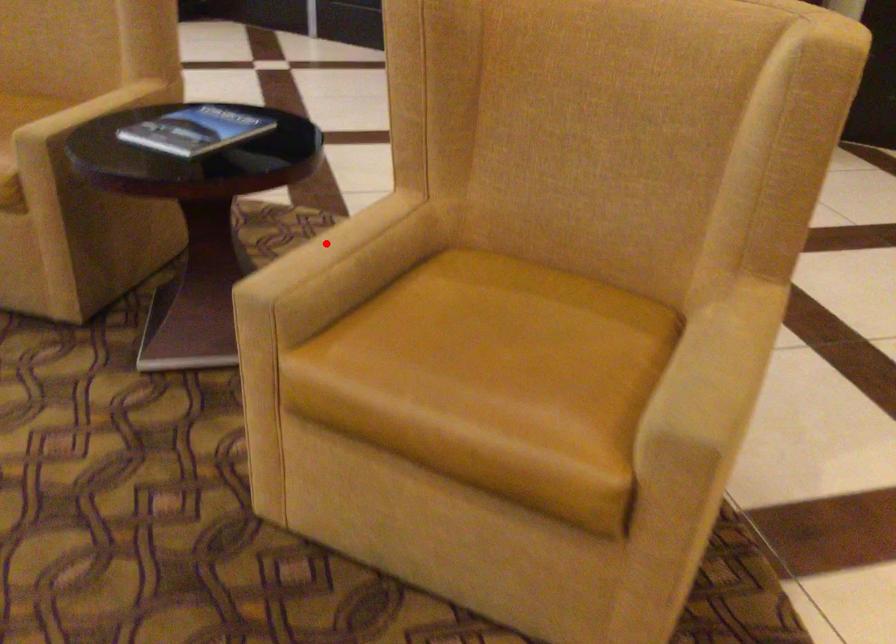
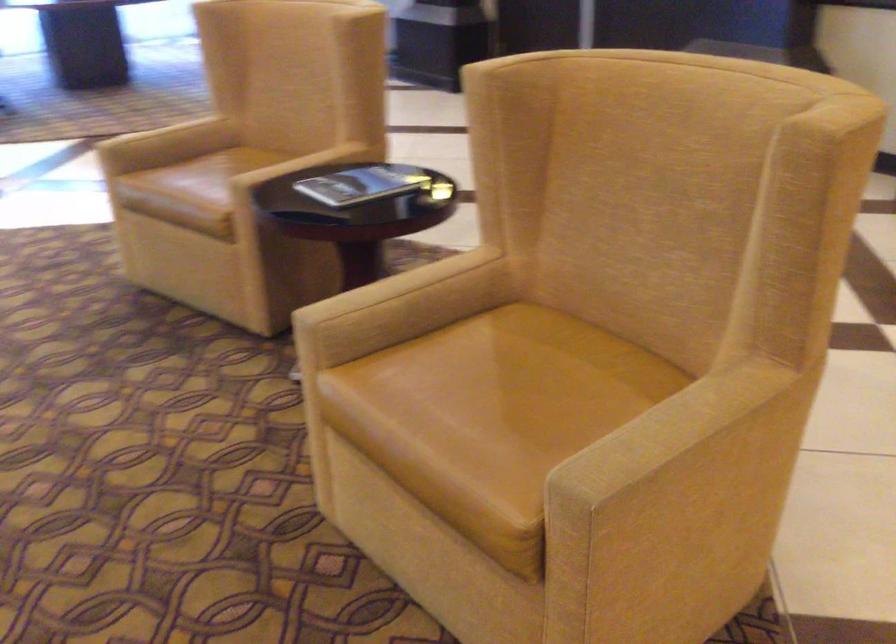
Locate, in the second image, the point that corresponds to the highlighted location in the first image.

(394, 286)